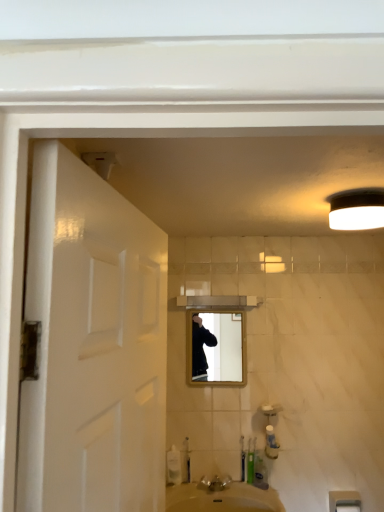
Question: Would you say white plastic towel bar at lower right is outside green plastic toothbrush at lower center?

Choices:
 (A) no
 (B) yes

Answer: (B)

Question: Are white plastic towel bar at lower right and green plastic toothbrush at lower center located far from each other?

Choices:
 (A) yes
 (B) no

Answer: (B)

Question: Is white plastic towel bar at lower right thinner than green plastic toothbrush at lower center?

Choices:
 (A) no
 (B) yes

Answer: (A)

Question: From a real-world perspective, is white plastic towel bar at lower right on green plastic toothbrush at lower center?

Choices:
 (A) yes
 (B) no

Answer: (B)

Question: Is white plastic towel bar at lower right directly adjacent to green plastic toothbrush at lower center?

Choices:
 (A) no
 (B) yes

Answer: (A)

Question: Looking at the image, does matte wooden mirror at center seem bigger or smaller compared to white plastic towel bar at lower right?

Choices:
 (A) small
 (B) big

Answer: (B)

Question: Is matte wooden mirror at center taller or shorter than white plastic towel bar at lower right?

Choices:
 (A) tall
 (B) short

Answer: (A)

Question: In terms of width, does matte wooden mirror at center look wider or thinner when compared to white plastic towel bar at lower right?

Choices:
 (A) thin
 (B) wide

Answer: (A)

Question: Based on their positions, is matte wooden mirror at center located to the left or right of white plastic towel bar at lower right?

Choices:
 (A) right
 (B) left

Answer: (B)

Question: Considering the positions of silver metallic faucet at lower center and white matte light fixture at upper right in the image, is silver metallic faucet at lower center taller or shorter than white matte light fixture at upper right?

Choices:
 (A) short
 (B) tall

Answer: (A)

Question: From a real-world perspective, is silver metallic faucet at lower center positioned above or below white matte light fixture at upper right?

Choices:
 (A) below
 (B) above

Answer: (A)

Question: Is silver metallic faucet at lower center wider or thinner than white matte light fixture at upper right?

Choices:
 (A) wide
 (B) thin

Answer: (B)

Question: Is silver metallic faucet at lower center in front of or behind white matte light fixture at upper right in the image?

Choices:
 (A) front
 (B) behind

Answer: (B)

Question: From the image's perspective, is white plastic towel bar at lower right above or below white matte light fixture at upper right?

Choices:
 (A) above
 (B) below

Answer: (B)

Question: From a real-world perspective, is white plastic towel bar at lower right above or below white matte light fixture at upper right?

Choices:
 (A) below
 (B) above

Answer: (A)